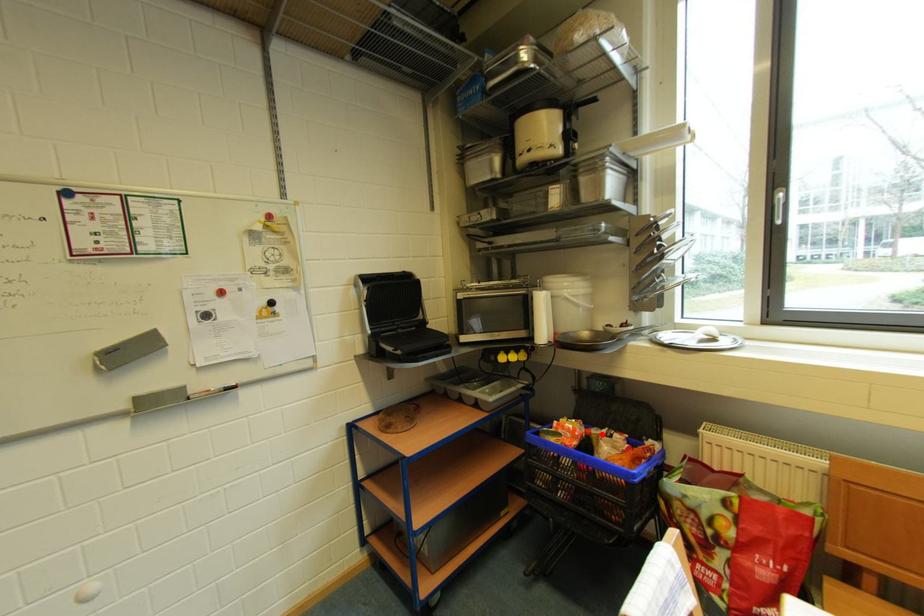
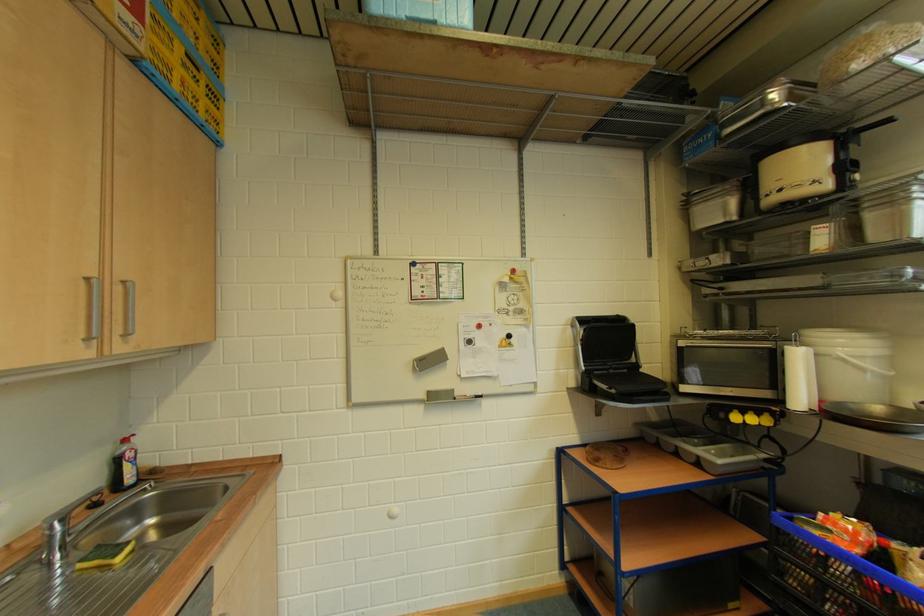
Question: I am providing you with two images of the same scene from different viewpoints. A red point is shown in image1. For the corresponding object point in image2, is it positioned nearer or farther from the camera?

Choices:
 (A) Nearer
 (B) Farther

Answer: (A)